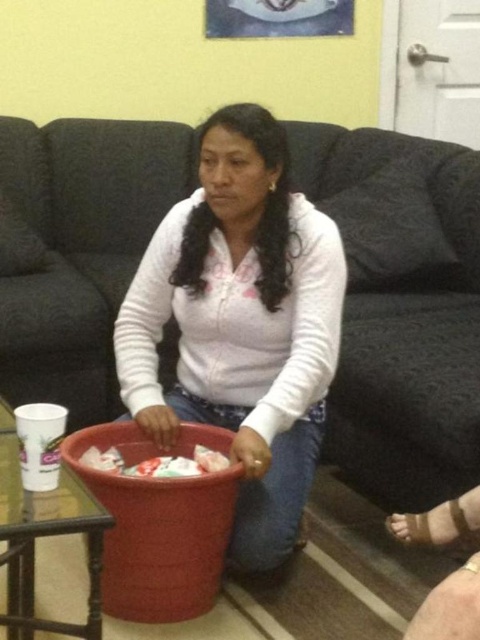
Does point (146, 125) lie behind point (229, 273)?

Yes, it is.

Image resolution: width=480 pixels, height=640 pixels. I want to click on dark fabric couch at center, so click(400, 308).